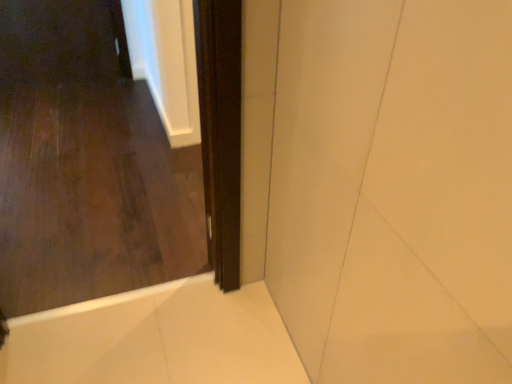
Question: From a real-world perspective, does dark wood screen door at center sit lower than dark wood door at center?

Choices:
 (A) no
 (B) yes

Answer: (B)

Question: Is dark wood screen door at center thinner than dark wood door at center?

Choices:
 (A) yes
 (B) no

Answer: (A)

Question: Is dark wood screen door at center located outside dark wood door at center?

Choices:
 (A) yes
 (B) no

Answer: (A)

Question: Is dark wood screen door at center oriented away from dark wood door at center?

Choices:
 (A) yes
 (B) no

Answer: (B)

Question: Considering the relative sizes of dark wood screen door at center and dark wood door at center in the image provided, is dark wood screen door at center taller than dark wood door at center?

Choices:
 (A) no
 (B) yes

Answer: (A)

Question: In the image, is dark wood screen door at center on the left side or the right side of white glossy bath at lower right?

Choices:
 (A) right
 (B) left

Answer: (A)

Question: Considering the positions of dark wood screen door at center and white glossy bath at lower right in the image, is dark wood screen door at center taller or shorter than white glossy bath at lower right?

Choices:
 (A) short
 (B) tall

Answer: (B)

Question: In terms of width, does dark wood screen door at center look wider or thinner when compared to white glossy bath at lower right?

Choices:
 (A) wide
 (B) thin

Answer: (B)

Question: Would you say dark wood screen door at center is inside or outside white glossy bath at lower right?

Choices:
 (A) outside
 (B) inside

Answer: (A)

Question: Looking at the image, does dark wood door at center seem bigger or smaller compared to dark wood screen door at center?

Choices:
 (A) big
 (B) small

Answer: (A)

Question: From a real-world perspective, is dark wood door at center positioned above or below dark wood screen door at center?

Choices:
 (A) below
 (B) above

Answer: (B)

Question: Visually, is dark wood door at center positioned to the left or to the right of dark wood screen door at center?

Choices:
 (A) left
 (B) right

Answer: (A)

Question: Relative to dark wood screen door at center, is dark wood door at center in front or behind?

Choices:
 (A) behind
 (B) front

Answer: (B)

Question: Considering their positions, is dark wood door at center located in front of or behind white glossy bath at lower right?

Choices:
 (A) front
 (B) behind

Answer: (A)

Question: From the image's perspective, relative to white glossy bath at lower right, is dark wood door at center above or below?

Choices:
 (A) above
 (B) below

Answer: (A)